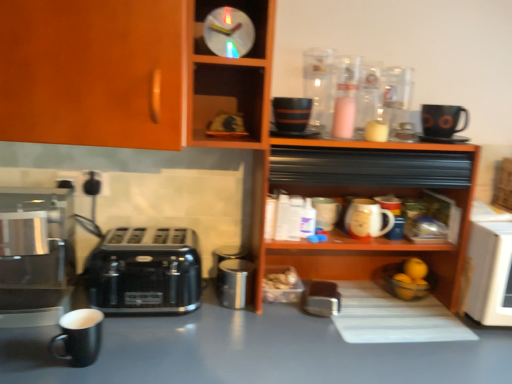
The width and height of the screenshot is (512, 384). I want to click on vacant space in front of black plastic toaster at lower left, so click(x=132, y=349).